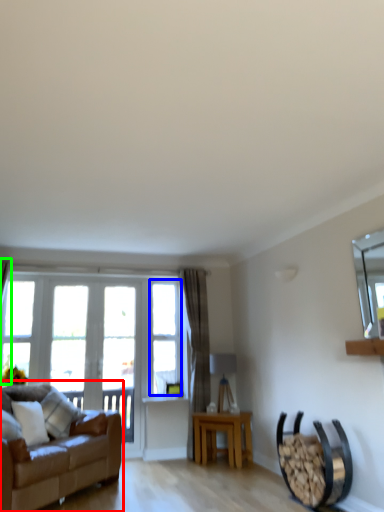
Question: Which object is the closest to the studio couch (highlighted by a red box)? Choose among these: window (highlighted by a blue box) or curtain (highlighted by a green box).

Choices:
 (A) window
 (B) curtain

Answer: (A)